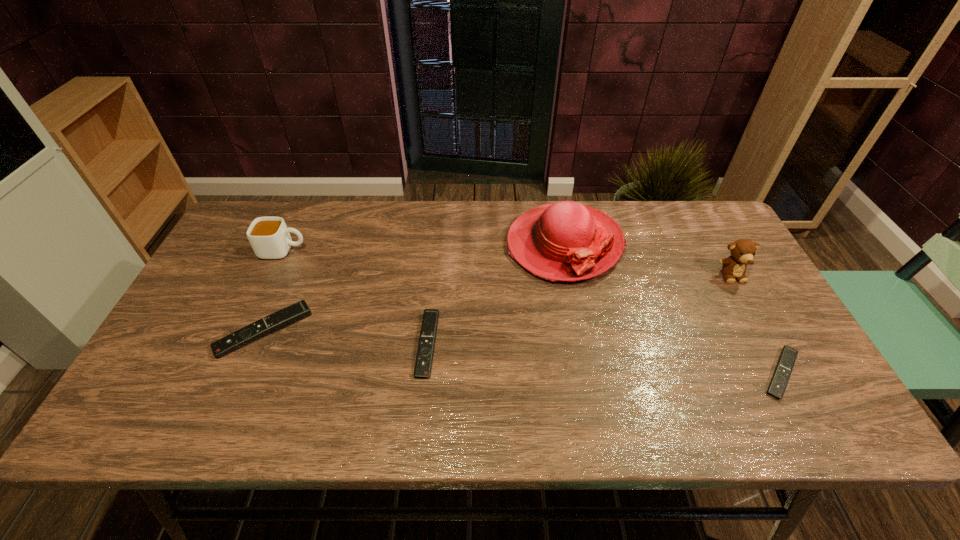
This screenshot has height=540, width=960. I want to click on remote control situated at the right edge, so (788, 355).

Locate an element on the screen. The height and width of the screenshot is (540, 960). teddy bear that is at the right edge is located at coordinates (743, 251).

Identify the location of object present at the far left corner. (269, 237).

This screenshot has height=540, width=960. I want to click on object present at the near right corner, so click(x=788, y=355).

Find the location of `free space at the far edge of the desktop`. free space at the far edge of the desktop is located at coordinates (484, 234).

In the image, there is a desktop. At what (x,y) coordinates should I click in order to perform the action: click on free region at the near edge. Please return your answer as a coordinate pair (x, y). The height and width of the screenshot is (540, 960). Looking at the image, I should click on (623, 378).

Where is `free space at the left edge`? Image resolution: width=960 pixels, height=540 pixels. free space at the left edge is located at coordinates (246, 264).

In the image, there is a desktop. Where is `vacant space at the right edge`? vacant space at the right edge is located at coordinates pyautogui.click(x=752, y=305).

The image size is (960, 540). In the image, there is a desktop. In order to click on free space at the far right corner in this screenshot , I will do `click(692, 244)`.

Where is `vacant region between the third object from left to right and the rightmost remote control`? vacant region between the third object from left to right and the rightmost remote control is located at coordinates (604, 359).